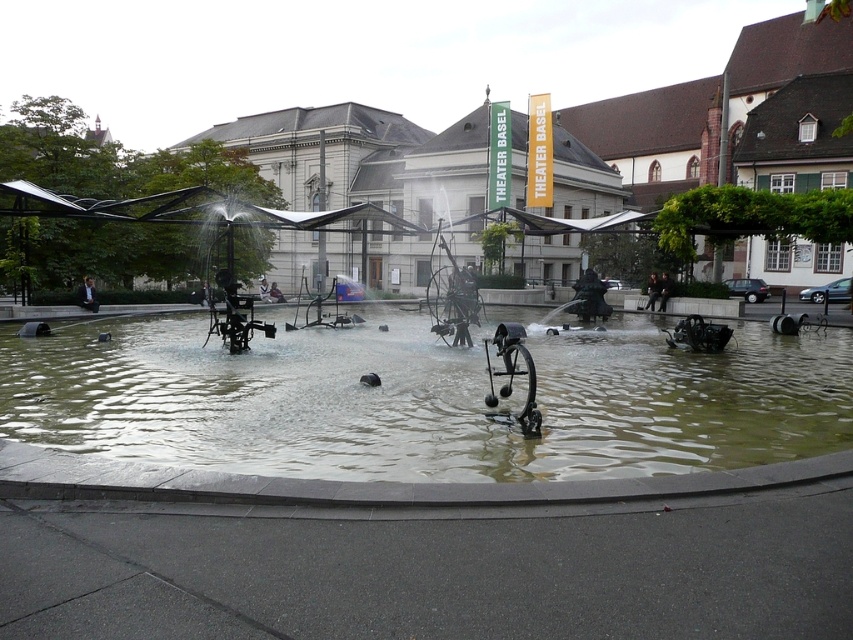
Who is higher up, greenish murky water at center or dark blue fabric jacket at center?

dark blue fabric jacket at center

Describe the element at coordinates (424, 400) in the screenshot. I see `greenish murky water at center` at that location.

Describe the element at coordinates (424, 400) in the screenshot. The height and width of the screenshot is (640, 853). I see `greenish murky water at center` at that location.

Identify the location of greenish murky water at center. (424, 400).

Which is above, greenish murky water at center or dark gray fabric jacket at center?

dark gray fabric jacket at center

Who is more forward, (27, 394) or (648, 292)?

Positioned in front is point (27, 394).

Identify the location of greenish murky water at center. This screenshot has height=640, width=853. (424, 400).

Does dark gray fabric jacket at center have a lesser height compared to dark blue fabric jacket at center?

Indeed, dark gray fabric jacket at center has a lesser height compared to dark blue fabric jacket at center.

Between dark gray fabric jacket at center and dark blue fabric jacket at center, which one is positioned higher?

dark blue fabric jacket at center is higher up.

Is point (656, 275) farther from viewer compared to point (274, 282)?

No, (656, 275) is in front of (274, 282).

Locate an element on the screen. Image resolution: width=853 pixels, height=640 pixels. dark gray fabric jacket at center is located at coordinates (653, 291).